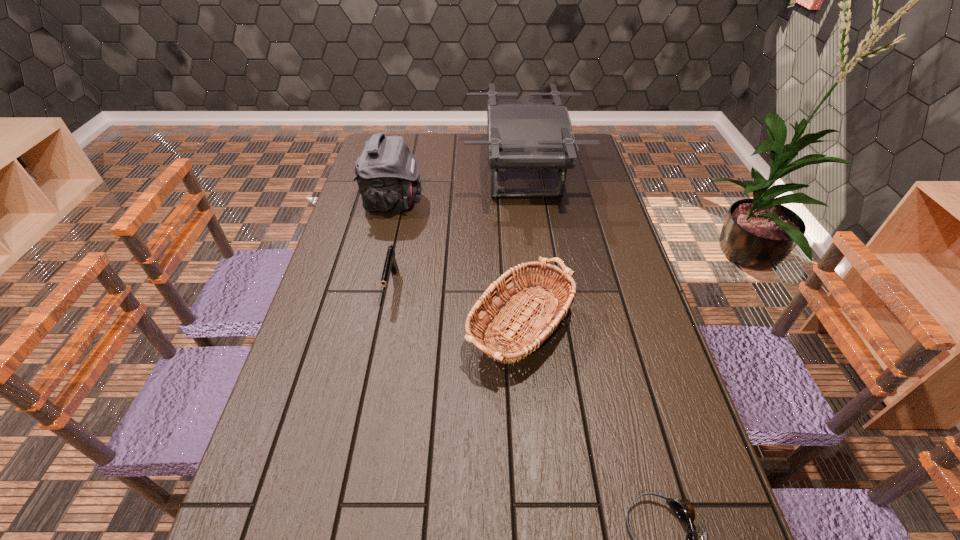
Where is `shoulder bag`? The image size is (960, 540). shoulder bag is located at coordinates (387, 173).

Find the location of a particular element. drone is located at coordinates (522, 133).

In order to click on basket in this screenshot , I will do `click(555, 293)`.

Locate an element on the screen. Image resolution: width=960 pixels, height=540 pixels. the fourth tallest object is located at coordinates (390, 265).

Where is `blank space located 0.090m on the open flap of the shoulder bag`? The height and width of the screenshot is (540, 960). blank space located 0.090m on the open flap of the shoulder bag is located at coordinates [x=448, y=202].

This screenshot has width=960, height=540. What are the coordinates of `vacant space located with a camera mounted on the underside of the drone` in the screenshot? It's located at (396, 175).

Where is `vacant space located 0.150m with a camera mounted on the underside of the drone`? This screenshot has height=540, width=960. vacant space located 0.150m with a camera mounted on the underside of the drone is located at coordinates (427, 175).

At what (x,y) coordinates should I click in order to perform the action: click on vacant space located with a camera mounted on the underside of the drone. Please return your answer as a coordinate pair (x, y). Looking at the image, I should click on (414, 175).

In order to click on free space located 0.280m on the left of the basket in this screenshot , I will do `click(354, 326)`.

Where is `vacant area situated 0.330m at the muzzle of the second shortest object`? vacant area situated 0.330m at the muzzle of the second shortest object is located at coordinates (367, 416).